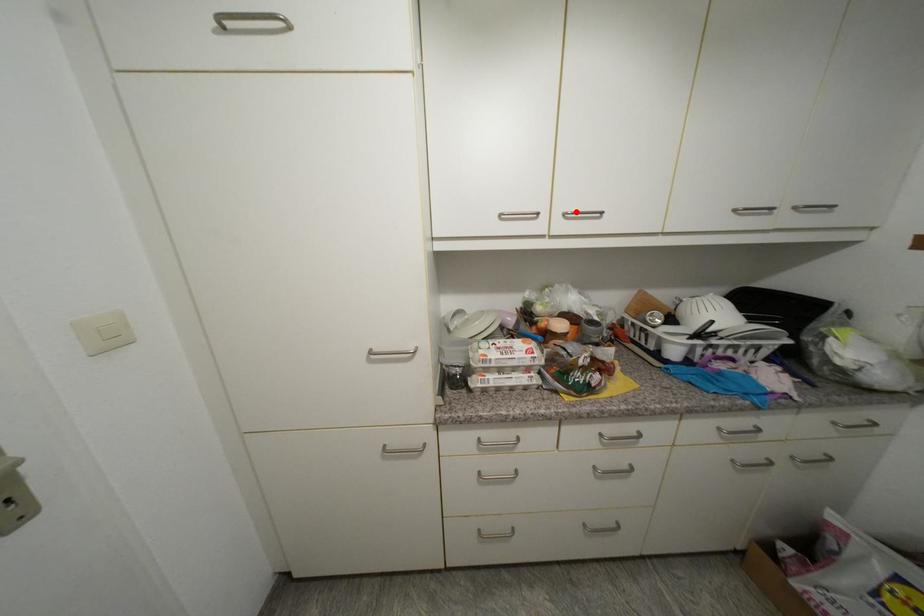
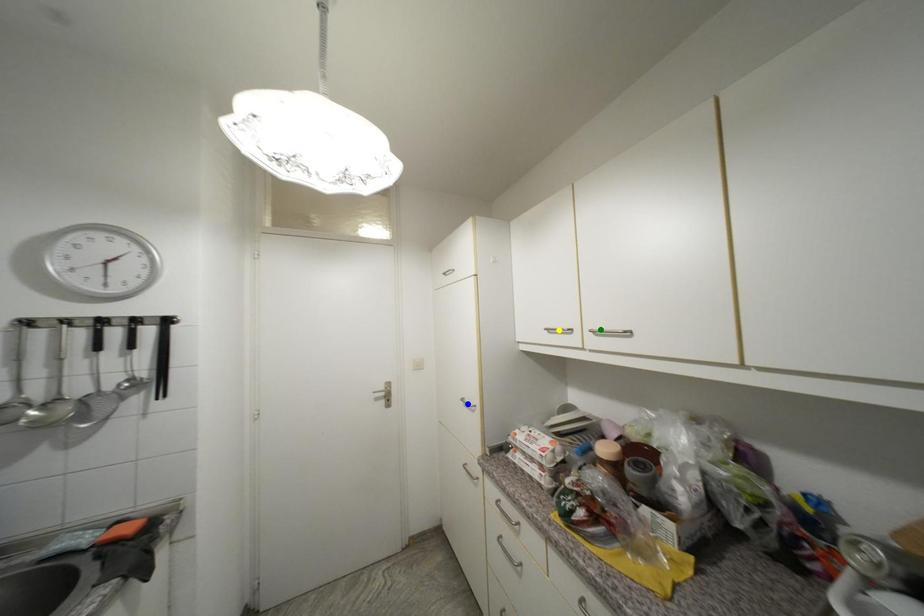
Question: I am providing you with two images of the same scene from different viewpoints. A red point is marked on the first image. You are given multiple points on the second image. Can you choose the point in image 2 that corresponds to the point in image 1?

Choices:
 (A) blue point
 (B) green point
 (C) yellow point

Answer: (B)